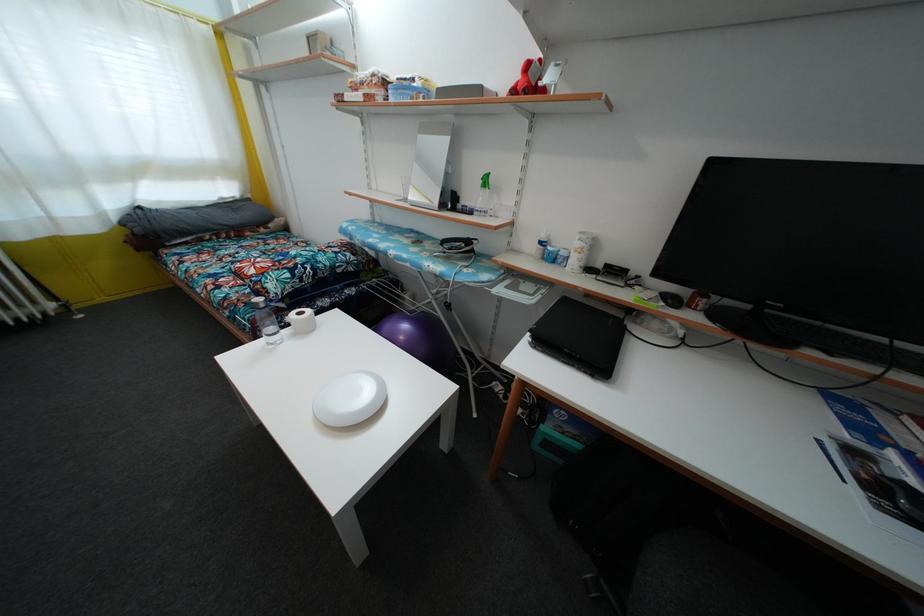
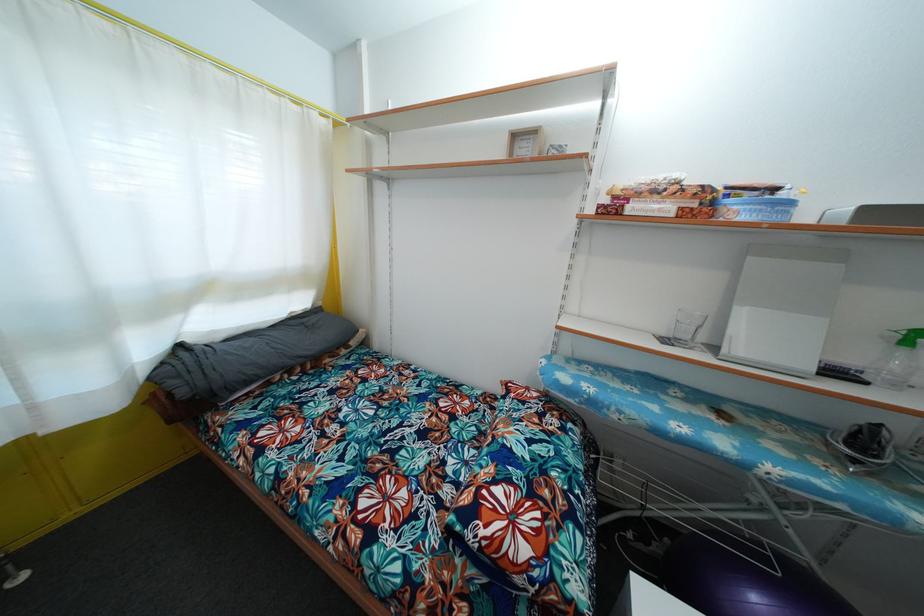
Which direction would the cameraman need to move to produce the second image?

The cameraman walked toward left, forward.